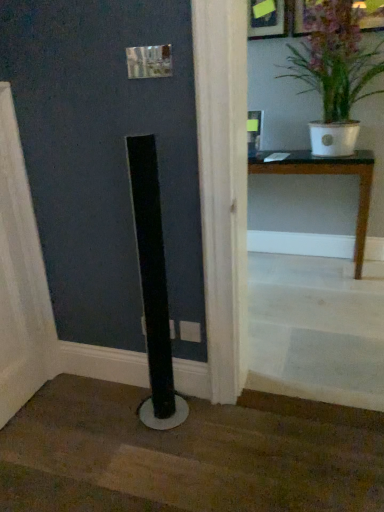
Image resolution: width=384 pixels, height=512 pixels. In order to click on black matte pole at lower center, positioned as the first stairwell in bottom-to-top order in this screenshot , I will do `click(187, 455)`.

Identify the location of white wooden stairs at lower right, the 2th stairwell in the bottom-to-top sequence. The height and width of the screenshot is (512, 384). (316, 329).

Image resolution: width=384 pixels, height=512 pixels. What do you see at coordinates (335, 70) in the screenshot?
I see `white glossy pot at upper right` at bounding box center [335, 70].

This screenshot has height=512, width=384. In order to click on black matte pole at lower center, positioned as the first stairwell in bottom-to-top order in this screenshot , I will do `click(187, 455)`.

Between white glossy pot at upper right and black matte pole at lower center, which appears as the 2th stairwell when viewed from the top, which one has larger size?

Bigger between the two is white glossy pot at upper right.

From a real-world perspective, is white glossy pot at upper right positioned above or below black matte pole at lower center, which appears as the 2th stairwell when viewed from the top?

white glossy pot at upper right is above black matte pole at lower center, which appears as the 2th stairwell when viewed from the top.

Which is closer, [357,44] or [141,441]?

The point [141,441] is more forward.

Is wooden table at center thinner than white wooden stairs at lower right, which is the first stairwell from top to bottom?

Yes.

Could you measure the distance between wooden table at center and white wooden stairs at lower right, the 2th stairwell in the bottom-to-top sequence?

A distance of 26.84 inches exists between wooden table at center and white wooden stairs at lower right, the 2th stairwell in the bottom-to-top sequence.

Does wooden table at center have a greater height compared to white wooden stairs at lower right, which is the first stairwell from top to bottom?

Yes.

Considering the points (358, 165) and (302, 388), which point is behind, point (358, 165) or point (302, 388)?

The point (358, 165) is farther from the camera.

Is white wooden stairs at lower right, the 2th stairwell in the bottom-to-top sequence, next to wooden table at center?

They are not placed beside each other.

Which object is thinner, white wooden stairs at lower right, the 2th stairwell in the bottom-to-top sequence, or wooden table at center?

With smaller width is wooden table at center.

Is white wooden stairs at lower right, the 2th stairwell in the bottom-to-top sequence, to the right of wooden table at center from the viewer's perspective?

In fact, white wooden stairs at lower right, the 2th stairwell in the bottom-to-top sequence, is to the left of wooden table at center.

Looking at this image, is white wooden stairs at lower right, which is the first stairwell from top to bottom, facing away from wooden table at center?

Correct, white wooden stairs at lower right, which is the first stairwell from top to bottom, is looking away from wooden table at center.

Which object is closer to the camera taking this photo, black matte pole at lower center, positioned as the first stairwell in bottom-to-top order, or white wooden stairs at lower right, which is the first stairwell from top to bottom?

black matte pole at lower center, positioned as the first stairwell in bottom-to-top order, is more forward.

From the image's perspective, is black matte pole at lower center, positioned as the first stairwell in bottom-to-top order, below white wooden stairs at lower right, which is the first stairwell from top to bottom?

Yes, from the image's perspective, black matte pole at lower center, positioned as the first stairwell in bottom-to-top order, is beneath white wooden stairs at lower right, which is the first stairwell from top to bottom.

Is black matte pole at lower center, which appears as the 2th stairwell when viewed from the top, bigger than white wooden stairs at lower right, the 2th stairwell in the bottom-to-top sequence?

No.

Considering the points (30, 434) and (307, 346), which point is behind, point (30, 434) or point (307, 346)?

The point (307, 346) is farther from the camera.

Considering the relative sizes of wooden table at center and white glossy pot at upper right in the image provided, is wooden table at center smaller than white glossy pot at upper right?

Yes, wooden table at center is smaller than white glossy pot at upper right.

At what (x,y) coordinates should I click in order to perform the action: click on table located below the white glossy pot at upper right (from the image's perspective). Please return your answer as a coordinate pair (x, y). Looking at the image, I should click on (327, 174).

Consider the image. Considering the relative sizes of wooden table at center and white glossy pot at upper right in the image provided, is wooden table at center taller than white glossy pot at upper right?

No.

From a real-world perspective, is black matte pole at lower center, which appears as the 2th stairwell when viewed from the top, over white glossy pot at upper right?

Incorrect, from a real-world perspective, black matte pole at lower center, which appears as the 2th stairwell when viewed from the top, is lower than white glossy pot at upper right.

Considering the relative positions of black matte pole at lower center, which appears as the 2th stairwell when viewed from the top, and white glossy pot at upper right in the image provided, is black matte pole at lower center, which appears as the 2th stairwell when viewed from the top, to the left or to the right of white glossy pot at upper right?

black matte pole at lower center, which appears as the 2th stairwell when viewed from the top, is positioned on white glossy pot at upper right's left side.

From the image's perspective, is black matte pole at lower center, positioned as the first stairwell in bottom-to-top order, above or below white glossy pot at upper right?

Clearly, from the image's perspective, black matte pole at lower center, positioned as the first stairwell in bottom-to-top order, is below white glossy pot at upper right.

Does point (301, 500) appear closer or farther from the camera than point (376, 47)?

Point (301, 500).

Looking at this image, from a real-world perspective, is wooden table at center physically located above or below black matte pole at lower center, positioned as the first stairwell in bottom-to-top order?

wooden table at center is situated higher than black matte pole at lower center, positioned as the first stairwell in bottom-to-top order, in the real world.

Between wooden table at center and black matte pole at lower center, which appears as the 2th stairwell when viewed from the top, which one has larger size?

wooden table at center is bigger.

Locate an element on the screen. The height and width of the screenshot is (512, 384). table above the black matte pole at lower center, which appears as the 2th stairwell when viewed from the top (from the image's perspective) is located at coordinates (327, 174).

Find the location of a particular element. houseplant positioned vertically above the black matte pole at lower center, which appears as the 2th stairwell when viewed from the top (from a real-world perspective) is located at coordinates (335, 70).

Which stairwell is the 1st one when counting from the front of the wooden table at center? Please provide its 2D coordinates.

[(316, 329)]

From the image, which object appears to be farther from wooden table at center, black matte pole at lower center, positioned as the first stairwell in bottom-to-top order, or white glossy pot at upper right?

black matte pole at lower center, positioned as the first stairwell in bottom-to-top order.

When comparing their distances from black matte pole at lower center, which appears as the 2th stairwell when viewed from the top, does wooden table at center or white wooden stairs at lower right, which is the first stairwell from top to bottom, seem further?

Based on the image, wooden table at center appears to be further to black matte pole at lower center, which appears as the 2th stairwell when viewed from the top.

Estimate the real-world distances between objects in this image. Which object is further from white glossy pot at upper right, white wooden stairs at lower right, which is the first stairwell from top to bottom, or black matte pole at lower center, which appears as the 2th stairwell when viewed from the top?

black matte pole at lower center, which appears as the 2th stairwell when viewed from the top, is positioned further to the anchor white glossy pot at upper right.

From the image, which object appears to be farther from white wooden stairs at lower right, which is the first stairwell from top to bottom, wooden table at center or white glossy pot at upper right?

white glossy pot at upper right.

From the image, which object appears to be nearer to black matte pole at lower center, positioned as the first stairwell in bottom-to-top order, white wooden stairs at lower right, the 2th stairwell in the bottom-to-top sequence, or white glossy pot at upper right?

white wooden stairs at lower right, the 2th stairwell in the bottom-to-top sequence, is closer to black matte pole at lower center, positioned as the first stairwell in bottom-to-top order.

Which object lies nearer to the anchor point white glossy pot at upper right, black matte pole at lower center, positioned as the first stairwell in bottom-to-top order, or wooden table at center?

wooden table at center lies closer to white glossy pot at upper right than the other object.

Looking at the image, which one is located further to white glossy pot at upper right, wooden table at center or black matte pole at lower center, positioned as the first stairwell in bottom-to-top order?

The object further to white glossy pot at upper right is black matte pole at lower center, positioned as the first stairwell in bottom-to-top order.

From the image, which object appears to be farther from wooden table at center, white glossy pot at upper right or black matte pole at lower center, positioned as the first stairwell in bottom-to-top order?

black matte pole at lower center, positioned as the first stairwell in bottom-to-top order, is further to wooden table at center.

Find the location of `stairwell between white glossy pot at upper right and black matte pole at lower center, positioned as the first stairwell in bottom-to-top order, vertically`. stairwell between white glossy pot at upper right and black matte pole at lower center, positioned as the first stairwell in bottom-to-top order, vertically is located at coordinates (316, 329).

The width and height of the screenshot is (384, 512). Identify the location of stairwell located between black matte pole at lower center, positioned as the first stairwell in bottom-to-top order, and wooden table at center in the depth direction. (316, 329).

Find the location of a particular element. This screenshot has height=512, width=384. table between white glossy pot at upper right and black matte pole at lower center, which appears as the 2th stairwell when viewed from the top, in the vertical direction is located at coordinates (327, 174).

The height and width of the screenshot is (512, 384). Find the location of `table that lies between white glossy pot at upper right and white wooden stairs at lower right, the 2th stairwell in the bottom-to-top sequence, from top to bottom`. table that lies between white glossy pot at upper right and white wooden stairs at lower right, the 2th stairwell in the bottom-to-top sequence, from top to bottom is located at coordinates (327, 174).